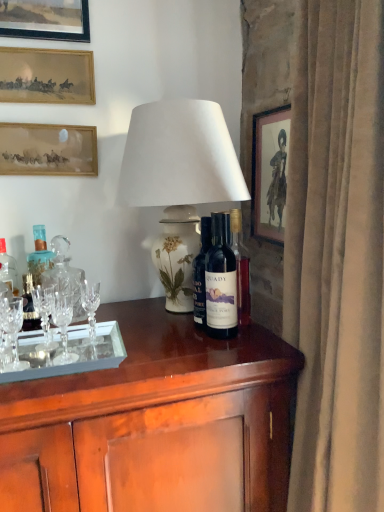
Question: From a real-world perspective, is white ceramic lamp at center over dark blue glass bottle at center, which is counted as the third bottle, starting from the left?

Choices:
 (A) yes
 (B) no

Answer: (A)

Question: Is there a large distance between white ceramic lamp at center and dark blue glass bottle at center, which is counted as the third bottle, starting from the left?

Choices:
 (A) no
 (B) yes

Answer: (A)

Question: Is white ceramic lamp at center taller than dark blue glass bottle at center, which appears as the 1th bottle when viewed from the right?

Choices:
 (A) no
 (B) yes

Answer: (B)

Question: From the image's perspective, is white ceramic lamp at center above dark blue glass bottle at center, which is counted as the third bottle, starting from the left?

Choices:
 (A) no
 (B) yes

Answer: (B)

Question: Is white ceramic lamp at center touching dark blue glass bottle at center, which appears as the 1th bottle when viewed from the right?

Choices:
 (A) no
 (B) yes

Answer: (A)

Question: In the image, is matte gold picture frame at upper left, which is counted as the third picture frame, starting from the bottom, positioned in front of or behind dark blue glass bottle at center, the 2th bottle viewed from the left?

Choices:
 (A) front
 (B) behind

Answer: (B)

Question: From a real-world perspective, is matte gold picture frame at upper left, which ranks as the second picture frame in top-to-bottom order, physically located above or below dark blue glass bottle at center, the 2th bottle viewed from the left?

Choices:
 (A) below
 (B) above

Answer: (B)

Question: Considering the positions of point (18, 53) and point (200, 294), is point (18, 53) closer or farther from the camera than point (200, 294)?

Choices:
 (A) closer
 (B) farther

Answer: (B)

Question: Would you say matte gold picture frame at upper left, the third picture frame from the left, is inside or outside dark blue glass bottle at center, the 2th bottle viewed from the left?

Choices:
 (A) outside
 (B) inside

Answer: (A)

Question: Relative to dark blue glass bottle at center, which appears as the 1th bottle when viewed from the right, is clear crystal wine glass at left in front or behind?

Choices:
 (A) behind
 (B) front

Answer: (A)

Question: Is point (9, 330) closer or farther from the camera than point (221, 263)?

Choices:
 (A) farther
 (B) closer

Answer: (A)

Question: Looking at their shapes, would you say clear crystal wine glass at left is wider or thinner than dark blue glass bottle at center, which appears as the 1th bottle when viewed from the right?

Choices:
 (A) thin
 (B) wide

Answer: (A)

Question: Choose the correct answer: Is clear crystal wine glass at left inside dark blue glass bottle at center, which is counted as the third bottle, starting from the left, or outside it?

Choices:
 (A) outside
 (B) inside

Answer: (A)

Question: From a real-world perspective, is matte gold picture frame at upper left, which is counted as the third picture frame, starting from the bottom, physically located above or below matte wooden picture frame at upper left, marked as the second picture frame in a left-to-right arrangement?

Choices:
 (A) below
 (B) above

Answer: (B)

Question: Is point (34, 80) closer or farther from the camera than point (51, 160)?

Choices:
 (A) closer
 (B) farther

Answer: (A)